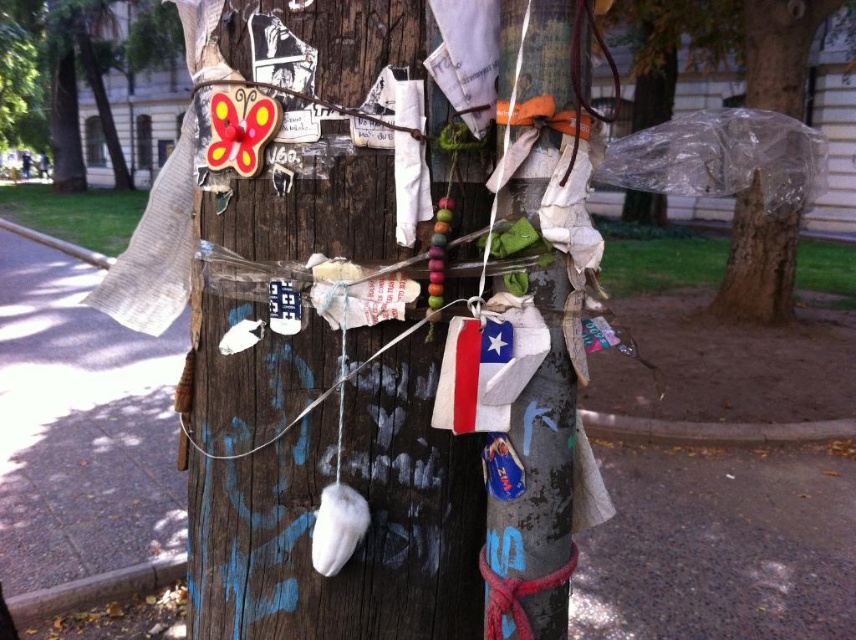
Does wooden butterfly at upper left appear on the left side of transparent plastic bag at upper right?

Yes, wooden butterfly at upper left is to the left of transparent plastic bag at upper right.

Who is shorter, wooden butterfly at upper left or transparent plastic bag at upper right?

transparent plastic bag at upper right

Is point (69, 61) closer to viewer compared to point (764, 230)?

No.

You are a GUI agent. You are given a task and a screenshot of the screen. Output one action in this format:
    pyautogui.click(x=<x>, y=<y>)
    Task: Click on the wooden butterfly at upper left
    This screenshot has width=856, height=640.
    Given the screenshot: What is the action you would take?
    pyautogui.click(x=72, y=72)

What do you see at coordinates (536, 493) in the screenshot?
I see `wooden pole at center` at bounding box center [536, 493].

Is wooden pole at center smaller than wooden butterfly at upper left?

Yes, wooden pole at center is smaller than wooden butterfly at upper left.

Does point (541, 269) come behind point (16, 131)?

That is False.

Image resolution: width=856 pixels, height=640 pixels. Identify the location of wooden pole at center. (536, 493).

Is point (575, 29) closer to camera compared to point (809, 38)?

Yes, point (575, 29) is closer to viewer.

Looking at this image, is wooden pole at center below transparent plastic bag at upper right?

Indeed, wooden pole at center is positioned under transparent plastic bag at upper right.

Is point (522, 177) farther from viewer compared to point (788, 291)?

No, (522, 177) is closer to viewer.

This screenshot has height=640, width=856. In order to click on wooden pole at center in this screenshot , I will do `click(536, 493)`.